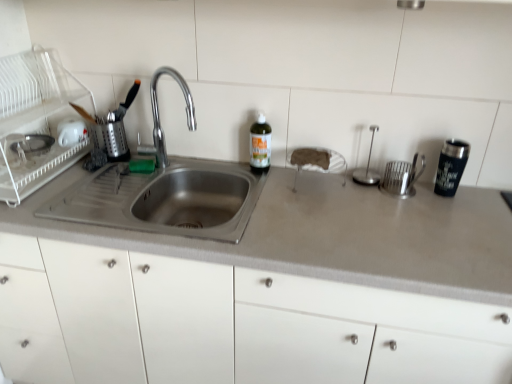
Where is `vacant area that is situated to the right of silver metallic utensil holder at right, positioned as the first appliance in right-to-left order`? vacant area that is situated to the right of silver metallic utensil holder at right, positioned as the first appliance in right-to-left order is located at coordinates (460, 200).